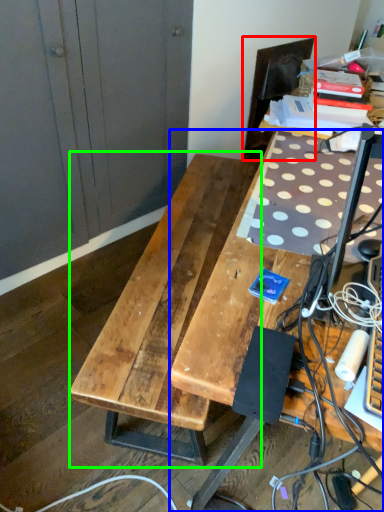
Question: Considering the real-world distances, which object is closest to swivel chair (highlighted by a red box)? desk (highlighted by a blue box) or table (highlighted by a green box).

Choices:
 (A) desk
 (B) table

Answer: (B)